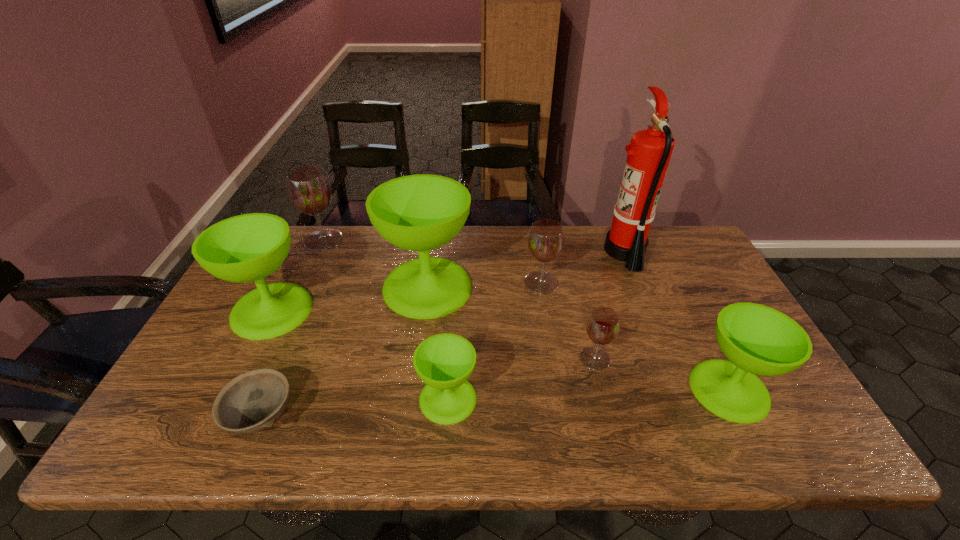
Image resolution: width=960 pixels, height=540 pixels. What are the coordinates of `vacant area situated 0.080m on the left of the biggest red wineglass` in the screenshot? It's located at (281, 240).

What are the coordinates of `vacant space located 0.120m on the front of the third smallest green wineglass` in the screenshot? It's located at (239, 377).

Where is `free point located 0.370m on the back of the rightmost green wineglass`? The height and width of the screenshot is (540, 960). free point located 0.370m on the back of the rightmost green wineglass is located at coordinates (668, 268).

Find the location of a particular element. The height and width of the screenshot is (540, 960). free point located 0.260m on the right of the second nearest red wineglass is located at coordinates (643, 282).

I want to click on vacant space situated 0.280m on the back of the smallest green wineglass, so click(454, 297).

At what (x,y) coordinates should I click in order to perform the action: click on vacant space located 0.210m on the left of the rightmost red wineglass. Please return your answer as a coordinate pair (x, y). Looking at the image, I should click on (497, 358).

Where is `blank area located on the right of the bowl`? blank area located on the right of the bowl is located at coordinates (445, 417).

The width and height of the screenshot is (960, 540). I want to click on fire extinguisher located at the far edge, so click(x=649, y=152).

This screenshot has width=960, height=540. Find the location of `bowl that is positioned at the near edge`. bowl that is positioned at the near edge is located at coordinates (253, 401).

I want to click on object present at the right edge, so click(x=756, y=339).